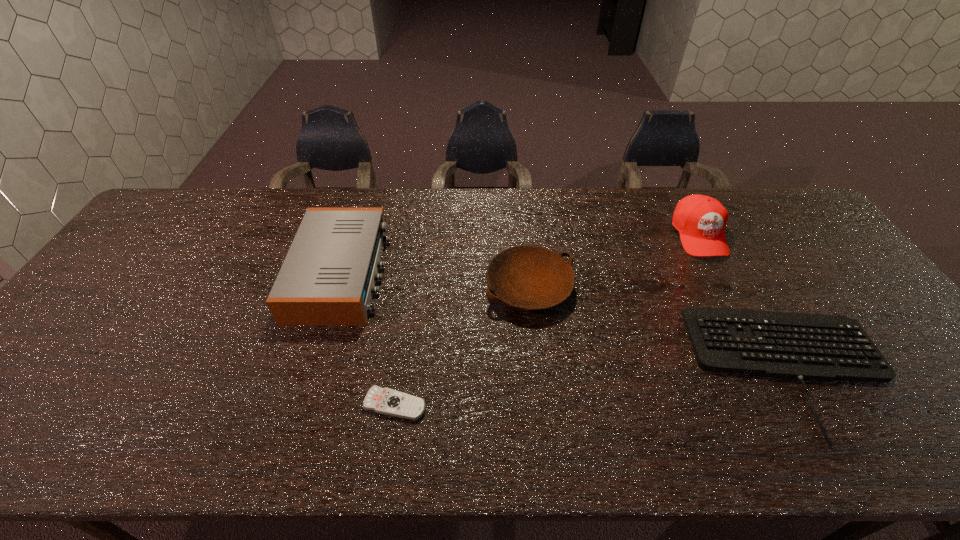
The width and height of the screenshot is (960, 540). In order to click on vacant space that satisfies the following two spatial constraints: 1. on the front panel of the radio receiver; 2. on the left side of the third object from left to right in this screenshot , I will do `click(337, 287)`.

I want to click on vacant space that satisfies the following two spatial constraints: 1. on the front panel of the tallest object; 2. on the front panel of the radio receiver, so click(x=718, y=273).

The image size is (960, 540). What are the coordinates of `vacant space that satisfies the following two spatial constraints: 1. on the front panel of the leftmost object; 2. on the right side of the third object from right to left` in the screenshot? It's located at tap(337, 287).

Where is `free region that satisfies the following two spatial constraints: 1. on the front panel of the tallest object; 2. on the right side of the computer keyboard`? free region that satisfies the following two spatial constraints: 1. on the front panel of the tallest object; 2. on the right side of the computer keyboard is located at coordinates (768, 369).

Where is `blank area in the image that satisfies the following two spatial constraints: 1. on the back side of the fourth object from right to left; 2. on the front panel of the second tallest object`? blank area in the image that satisfies the following two spatial constraints: 1. on the back side of the fourth object from right to left; 2. on the front panel of the second tallest object is located at coordinates (414, 273).